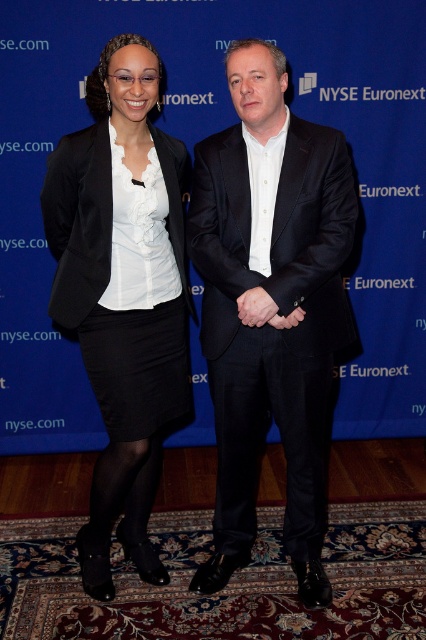
In the scene shown: Who is positioned more to the right, matte black skirt at left or matte black hand at center?

matte black hand at center is more to the right.

Who is more distant from viewer, (140,444) or (250,294)?

Positioned behind is point (140,444).

You are a GUI agent. You are given a task and a screenshot of the screen. Output one action in this format:
    pyautogui.click(x=<x>, y=<y>)
    Task: Click on the matte black skirt at left
    This screenshot has height=640, width=426.
    Given the screenshot: What is the action you would take?
    pyautogui.click(x=123, y=292)

Is black matte suit at center further to camera compared to matte black skirt at left?

No, it is in front of matte black skirt at left.

Which of these two, black matte suit at center or matte black skirt at left, stands taller?

matte black skirt at left is taller.

This screenshot has height=640, width=426. Identify the location of black matte suit at center. (275, 301).

Is point (247, 109) more distant than point (259, 314)?

No, it is not.

Is point (245, 376) positioned behind point (273, 312)?

That is True.

Find the location of `black matte suit at center`. black matte suit at center is located at coordinates (275, 301).